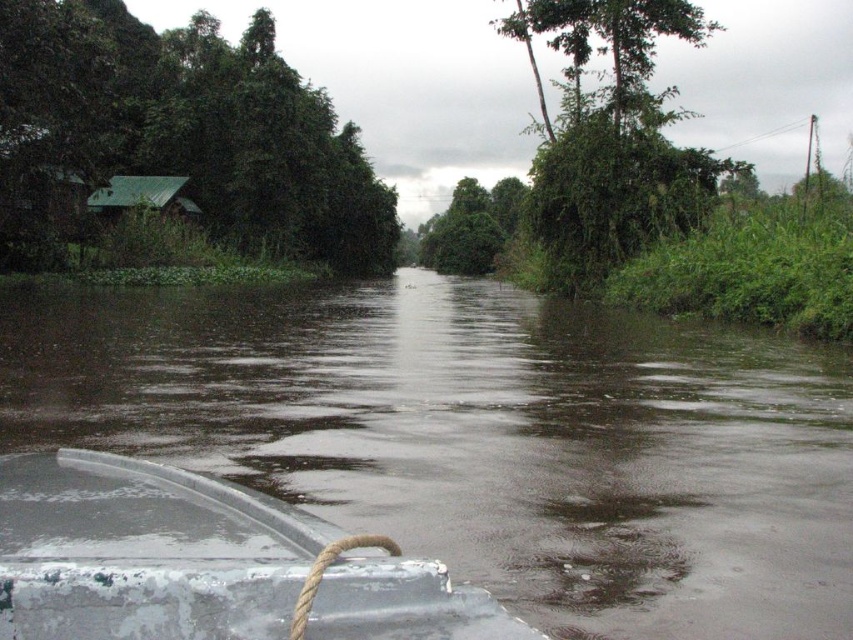
Between green matte roof at upper left and green matte hut at left, which one has less height?

With less height is green matte hut at left.

Does point (109, 118) come in front of point (90, 204)?

That is False.

Locate an element on the screen. The image size is (853, 640). green matte roof at upper left is located at coordinates (184, 129).

Who is taller, white matte boat at center or green leafy tree at upper center?

With more height is green leafy tree at upper center.

Which is above, white matte boat at center or green leafy tree at upper center?

green leafy tree at upper center

This screenshot has width=853, height=640. What are the coordinates of `white matte boat at center` in the screenshot? It's located at (144, 552).

Is glossy dark water at center to the left of green leafy tree at upper center from the viewer's perspective?

Indeed, glossy dark water at center is positioned on the left side of green leafy tree at upper center.

Locate an element on the screen. glossy dark water at center is located at coordinates (482, 436).

Locate an element on the screen. The image size is (853, 640). glossy dark water at center is located at coordinates (482, 436).